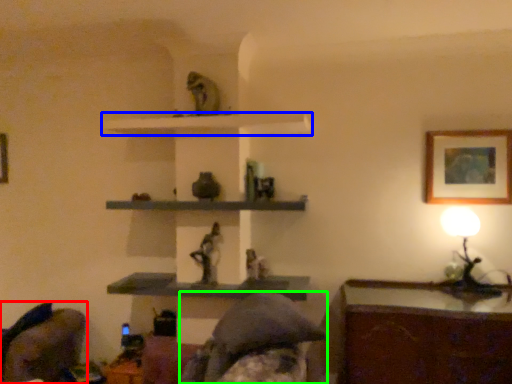
Question: Estimate the real-world distances between objects in this image. Which object is closer to swivel chair (highlighted by a red box), shelf (highlighted by a blue box) or person (highlighted by a green box)?

Choices:
 (A) shelf
 (B) person

Answer: (B)